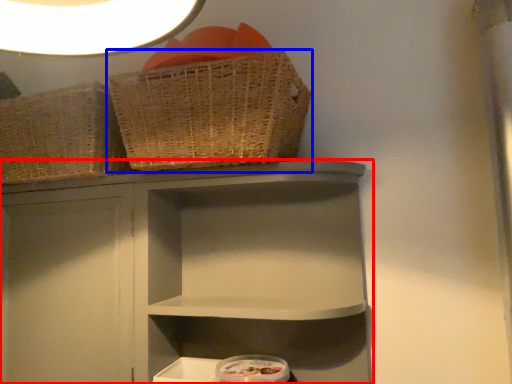
Question: Which of the following is the farthest to the observer, shelf (highlighted by a red box) or basket (highlighted by a blue box)?

Choices:
 (A) shelf
 (B) basket

Answer: (A)